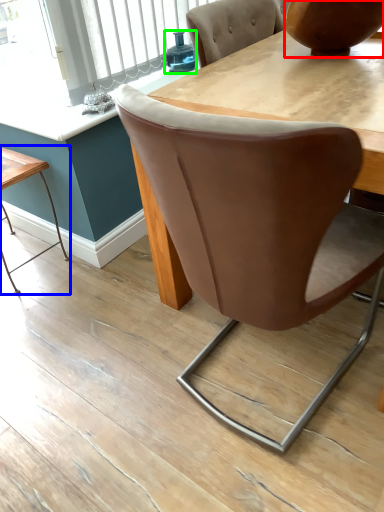
Question: Which object is positioned farthest from vase (highlighted by a red box)? Select from table (highlighted by a blue box) and teal (highlighted by a green box).

Choices:
 (A) table
 (B) teal

Answer: (A)